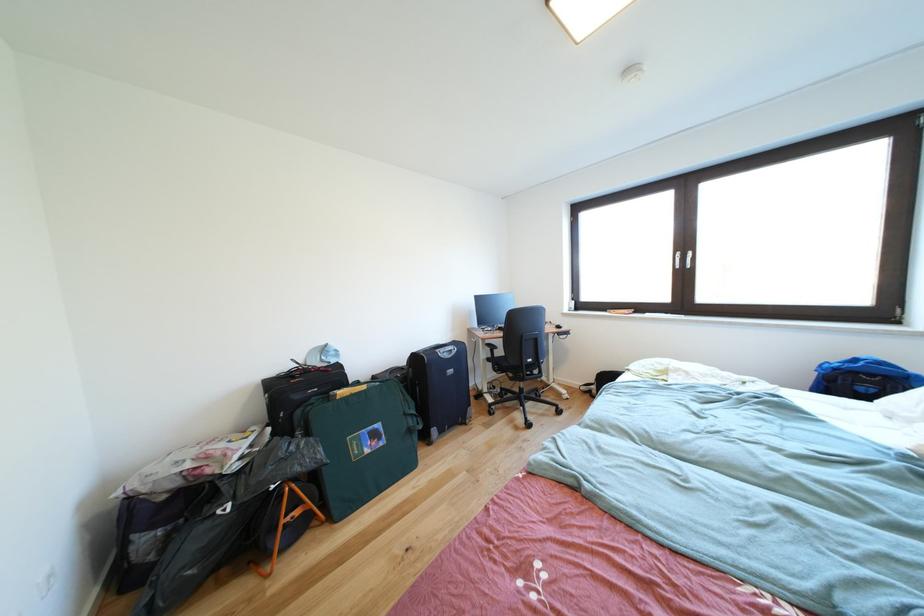
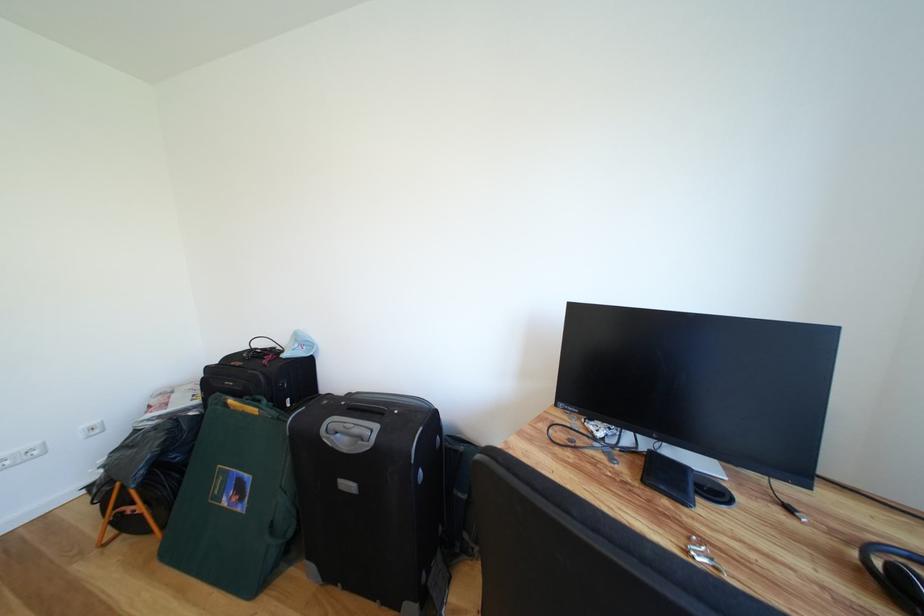
Find the pixel in the second image that matches [456,361] in the first image.

(353, 455)